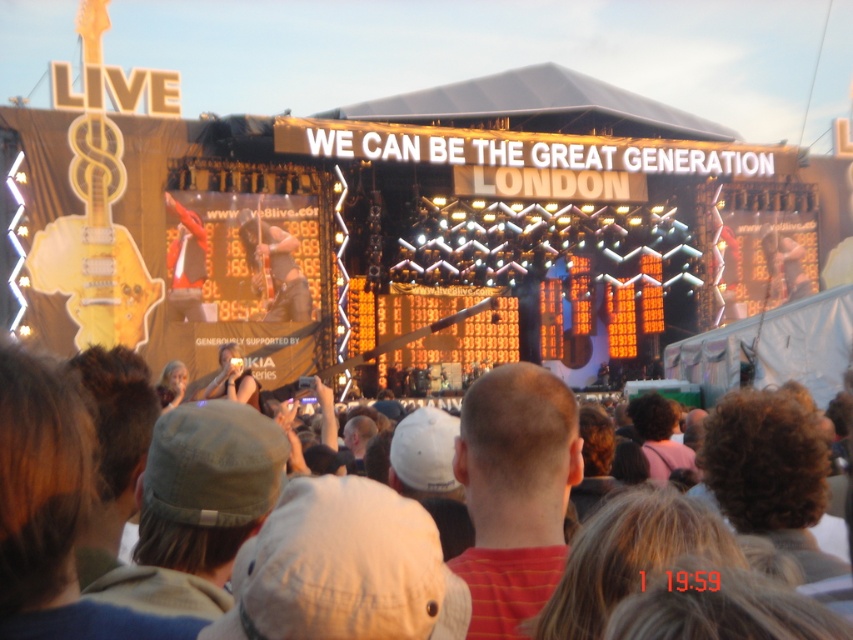
You are a photographer at the concert and want to take a photo of the red striped shirt at center without the white cotton hat at center blocking it. What should you do?

Move the camera backward so that the white cotton hat at center is no longer in front of the red striped shirt at center.

You are a photographer standing at the camera position. You want to capture a closeup shot of the white cotton hat at center. Given that your telephoto lens can focus up to 50 meters, will you be able to get a clear closeup?

The white cotton hat at center is 54.07 meters away from the camera, which exceeds the telephoto lens maximum focus distance of 50 meters. Therefore, you won not be able to get a clear closeup.

You are a photographer at the concert and want to capture a photo that includes both the red striped shirt at center and the yellow matte guitar at upper left. Based on their positions, which object should be placed in the foreground of your photo?

The red striped shirt at center should be placed in the foreground because it is positioned under the yellow matte guitar at upper left, meaning it is closer to the camera.